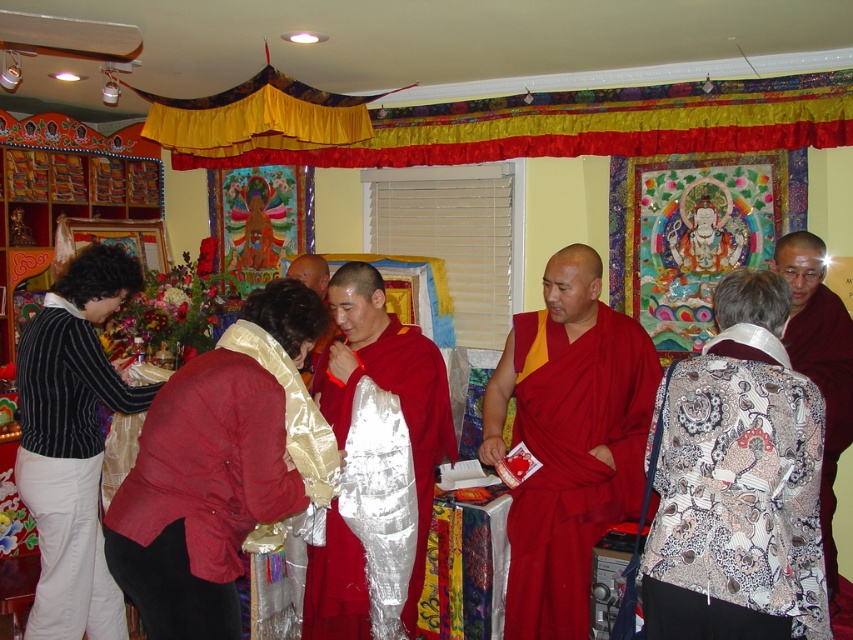
Question: Is matte red robe at center smaller than shiny silver robe at center?

Choices:
 (A) yes
 (B) no

Answer: (A)

Question: Which of the following is the farthest from the observer?

Choices:
 (A) pos(329,605)
 (B) pos(727,422)
 (C) pos(618,420)
 (D) pos(166,611)

Answer: (C)

Question: Observing the image, what is the correct spatial positioning of red satin robe at center in reference to matte red robe at center?

Choices:
 (A) above
 (B) below

Answer: (A)

Question: Considering the real-world distances, which object is farthest from the red satin robe at center?

Choices:
 (A) matte red robe at center
 (B) shiny silver robe at center

Answer: (A)

Question: Is matte red robe at center wider than striped wool sweater at lower left?

Choices:
 (A) yes
 (B) no

Answer: (A)

Question: Which point is farther to the camera?

Choices:
 (A) striped wool sweater at lower left
 (B) shiny silver robe at center
 (C) red satin robe at center
 (D) shiny red robe at center

Answer: (D)